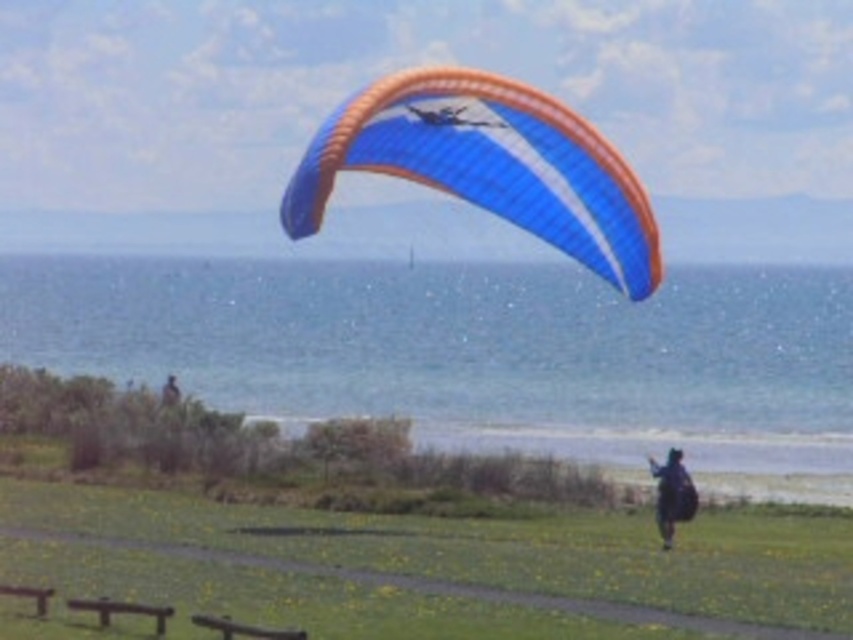
You are a photographer trying to capture the paraglider in the sky. You have a green grassy field at lower center and a dark blue fabric backpack at lower right in your viewfinder. Which object should you focus on to ensure the paraglider is centered in your shot?

The green grassy field at lower center is larger in size than the dark blue fabric backpack at lower right, so focusing on the green grassy field at lower center would provide a better reference point to center the paraglider in the sky.

Consider the image. You are standing on the grassy area dotted with yellow flowers and want to take a photo of the blue water at upper center and the dark blue fabric jacket at lower right. Which object should you focus on first if you want to capture both in a single frame without moving the camera?

The blue water at upper center is taller than the dark blue fabric jacket at lower right, so you should focus on the blue water at upper center first to ensure it is in focus before the jacket, as it is larger in the frame.